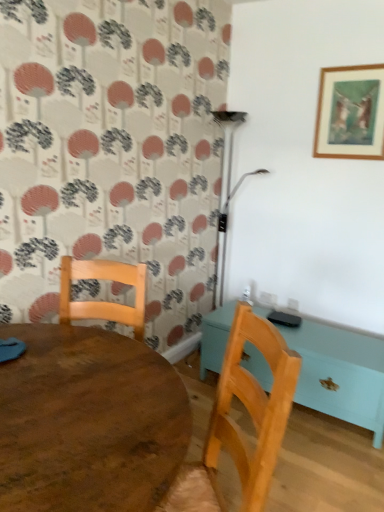
Find the location of `empty space that is ontop of wooden table at center, which is the 2th table from back to front (from a real-world perspective)`. empty space that is ontop of wooden table at center, which is the 2th table from back to front (from a real-world perspective) is located at coordinates (79, 384).